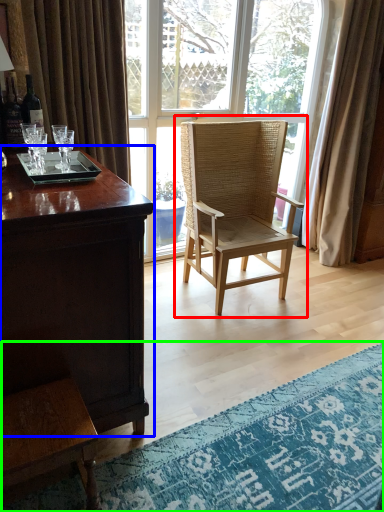
Question: Which object is the farthest from chair (highlighted by a red box)? Choose among these: desk (highlighted by a blue box) or mat (highlighted by a green box).

Choices:
 (A) desk
 (B) mat

Answer: (A)